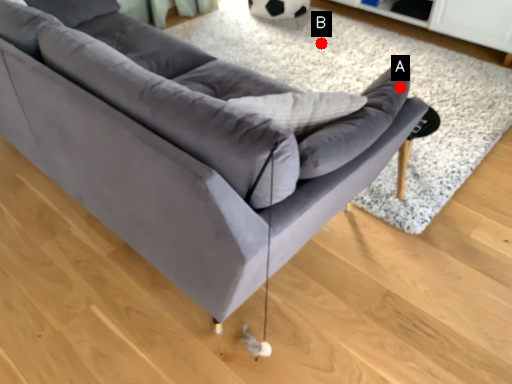
Question: Two points are circled on the image, labeled by A and B beside each circle. Which point is farther from the camera taking this photo?

Choices:
 (A) A is further
 (B) B is further

Answer: (B)